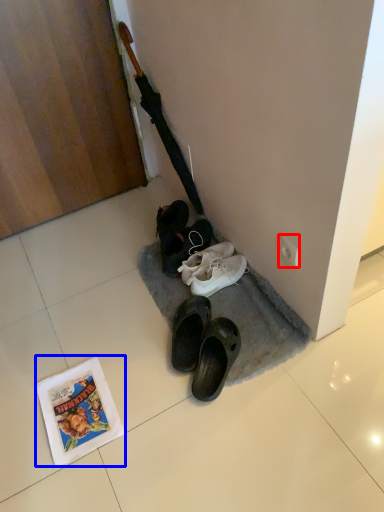
Question: Which of the following is the closest to the observer, power outlet (highlighted by a red box) or comic book (highlighted by a blue box)?

Choices:
 (A) power outlet
 (B) comic book

Answer: (B)